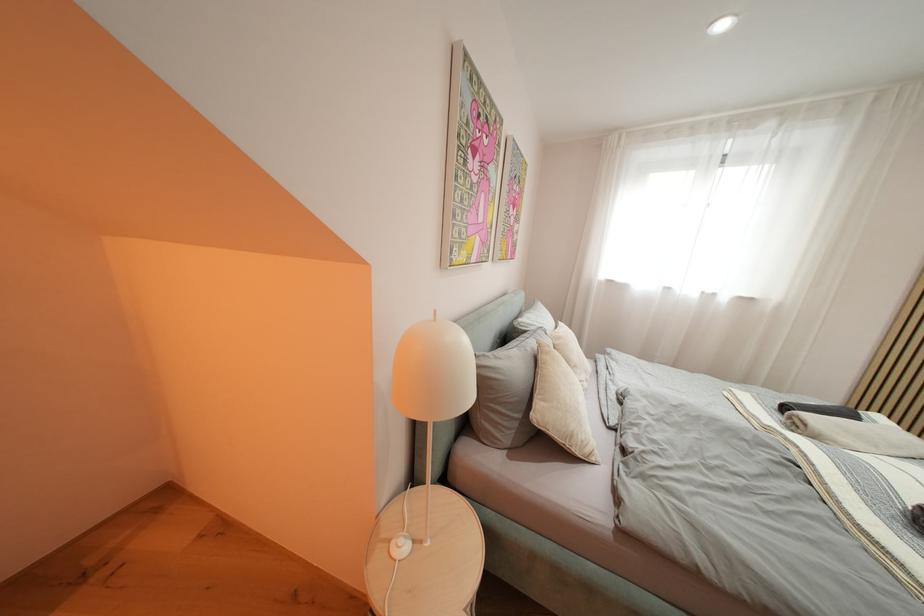
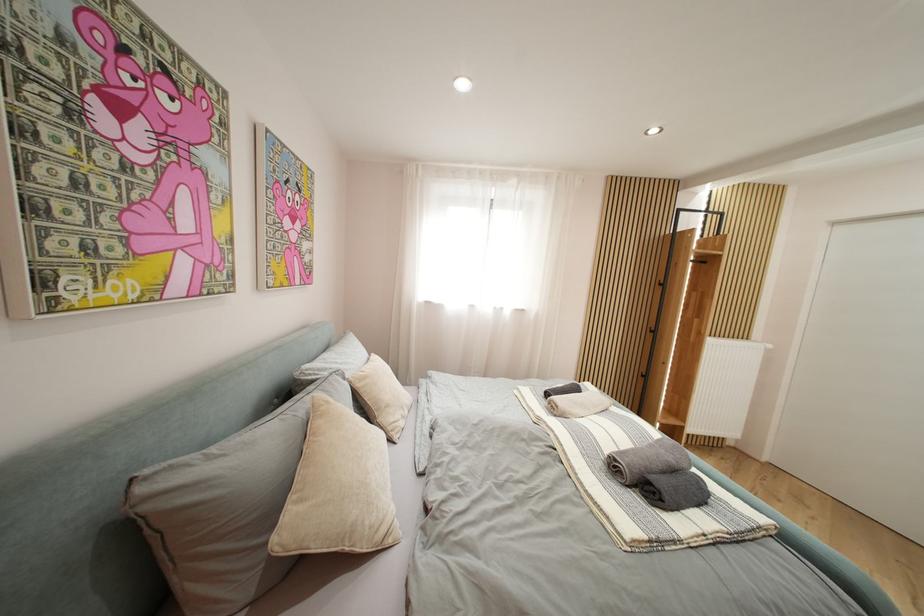
Question: Based on the continuous images, in which direction is the camera rotating? Reply with the corresponding letter.

Choices:
 (A) Left
 (B) Right
 (C) Up
 (D) Down

Answer: (B)